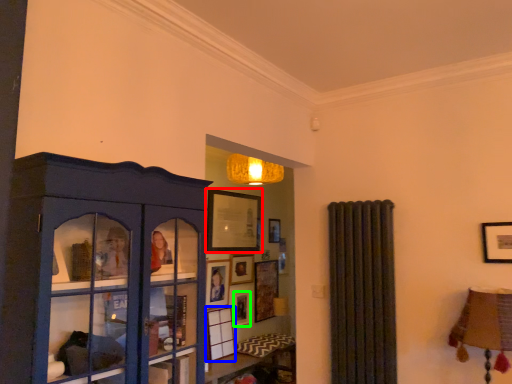
Question: Estimate the real-world distances between objects in this image. Which object is closer to picture frame (highlighted by a red box), picture frame (highlighted by a blue box) or picture frame (highlighted by a green box)?

Choices:
 (A) picture frame
 (B) picture frame

Answer: (B)